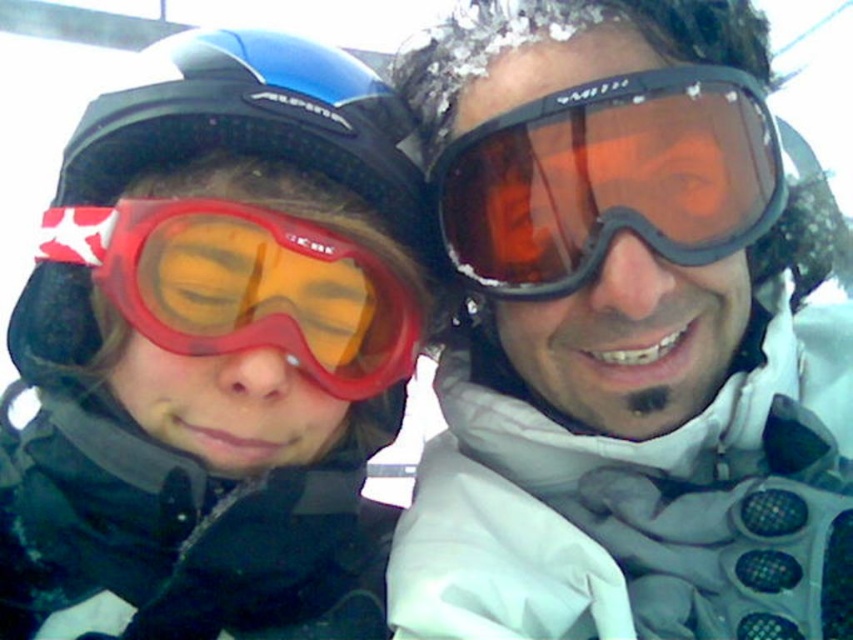
From the picture: You are trying to decide which pair of goggles to wear for a sunny day. The matte orange lens goggles at center and the matte red ski goggles at left are options. Which pair has a thinner frame?

The matte orange lens goggles at center are thinner than the matte red ski goggles at left, so the matte orange lens goggles at center would be the better choice for a sunny day if you prefer a thinner frame.

You are a photographer trying to capture both the matte orange lens goggles at center and the matte red ski goggles at left in a single shot. Based on their positions, which goggles should you focus on first to ensure both are in frame?

The matte orange lens goggles at center is to the right of the matte red ski goggles at left. To capture both in a single shot, focus on the matte red ski goggles at left first as it is on the left side, allowing the matte orange lens goggles at center to naturally fall into the frame to the right.

You are a photographer trying to capture a group photo of the matte orange lens goggles at center and the matte red ski goggles at left. The minimum distance your camera can focus on two objects clearly is 12 inches. Do you think you can take a clear photo of both goggles at the same time?

The matte orange lens goggles at center and the matte red ski goggles at left are 12.10 inches apart from each other. Since the distance between them is slightly more than 12 inches, your camera should be able to focus both goggles clearly in the photo.